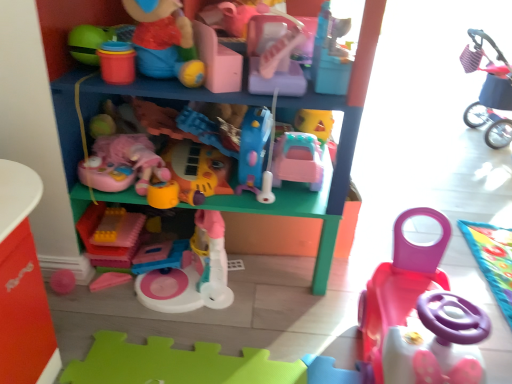
The height and width of the screenshot is (384, 512). I want to click on vacant area that is in front of translucent yellow plastic blocks at center, the first toy when ordered from left to right, so click(x=97, y=284).